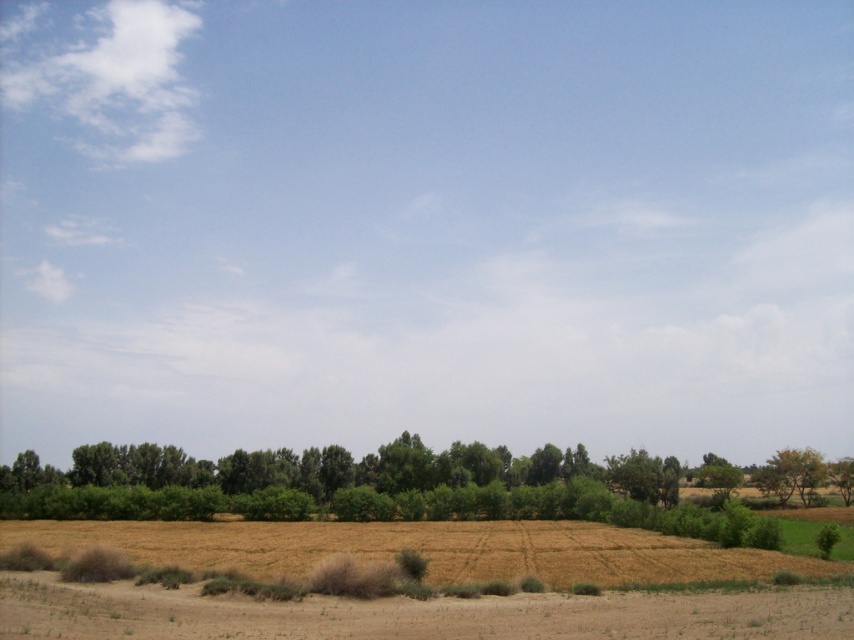
Between brown dry soil at lower center and green leafy tree at right, which one is positioned lower?

Positioned lower is green leafy tree at right.

Can you confirm if brown dry soil at lower center is positioned below green leafy tree at right?

No.

Does point (247, 525) come behind point (768, 481)?

No, it is not.

Identify the location of brown dry soil at lower center. (424, 548).

Which of these two, green leafy trees at center or brown dry soil at lower center, stands taller?

green leafy trees at center is taller.

This screenshot has height=640, width=854. What do you see at coordinates (328, 481) in the screenshot?
I see `green leafy trees at center` at bounding box center [328, 481].

Between point (154, 454) and point (577, 579), which one is positioned in front?

Positioned in front is point (577, 579).

Locate an element on the screen. The width and height of the screenshot is (854, 640). green leafy trees at center is located at coordinates (328, 481).

Does green leafy trees at center have a greater width compared to green leafy tree at right?

Yes.

Who is positioned more to the right, green leafy trees at center or green leafy tree at right?

Positioned to the right is green leafy tree at right.

Locate an element on the screen. green leafy trees at center is located at coordinates (328, 481).